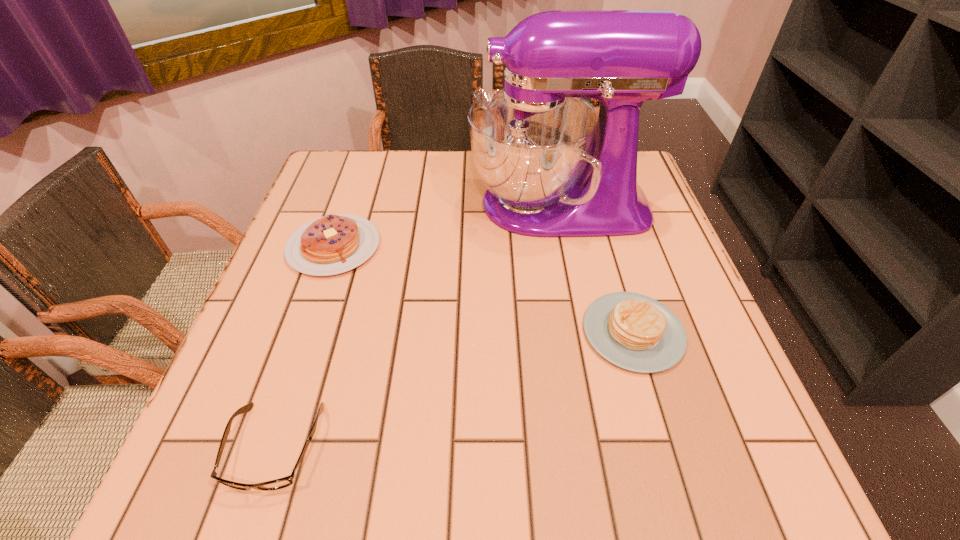
I want to click on object that is at the far edge, so click(553, 167).

This screenshot has height=540, width=960. Find the location of `object situated at the near edge`. object situated at the near edge is located at coordinates (284, 482).

The width and height of the screenshot is (960, 540). Identify the location of pancake positioned at the left edge. (335, 243).

The image size is (960, 540). Find the location of `spectacles that is at the left edge`. spectacles that is at the left edge is located at coordinates (284, 482).

I want to click on mixer that is at the right edge, so click(553, 167).

Identify the location of pancake present at the right edge. The height and width of the screenshot is (540, 960). (635, 332).

Identify the location of object that is at the near left corner. (284, 482).

Image resolution: width=960 pixels, height=540 pixels. Find the location of `object that is at the far right corner`. object that is at the far right corner is located at coordinates (553, 167).

At what (x,y) coordinates should I click in order to perform the action: click on blank space at the far edge of the desktop. Please return your answer as a coordinate pair (x, y). The width and height of the screenshot is (960, 540). Looking at the image, I should click on (470, 185).

Find the location of a particular element. The height and width of the screenshot is (540, 960). vacant position at the near edge of the desktop is located at coordinates (428, 464).